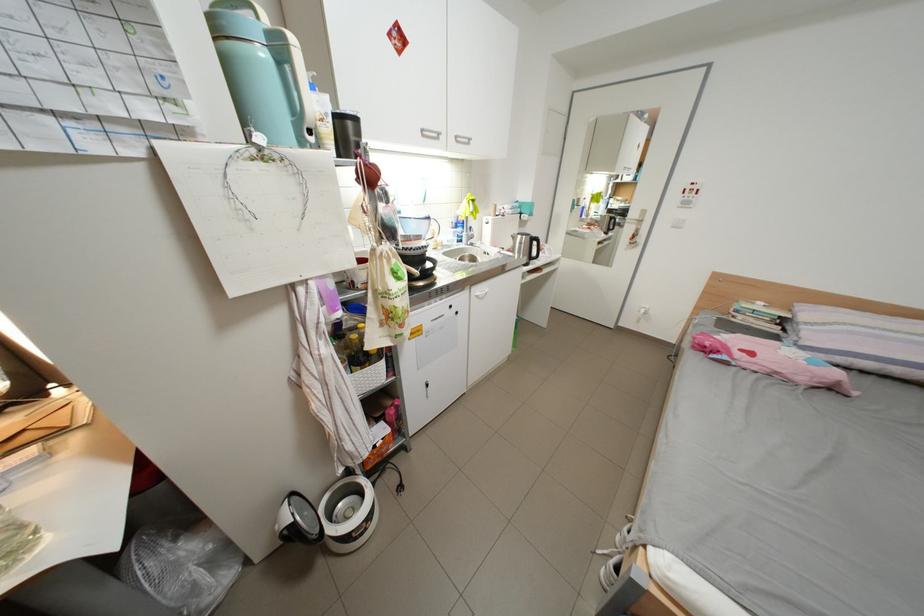
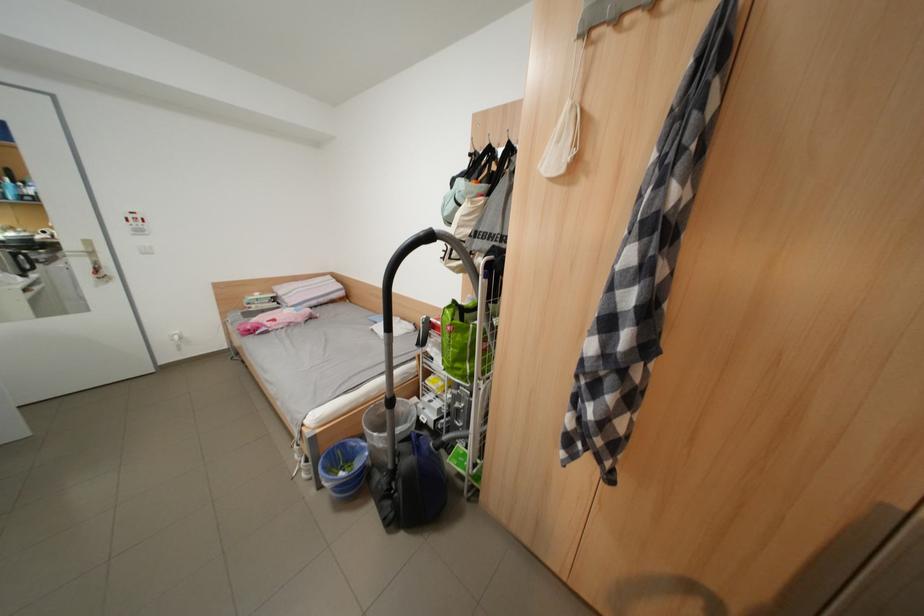
Find the pixel in the second image that matches pixel 719 345 in the first image.

(261, 329)